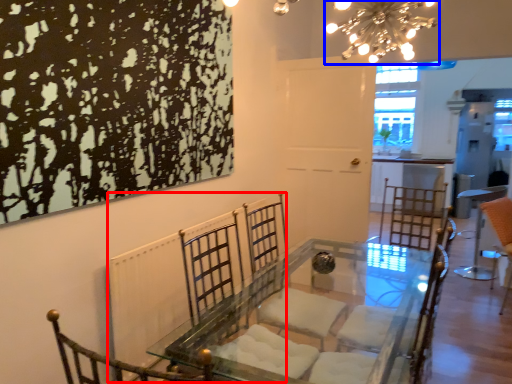
Question: Which of the following is the closest to the observer, radiator (highlighted by a red box) or light fixture (highlighted by a blue box)?

Choices:
 (A) radiator
 (B) light fixture

Answer: (A)